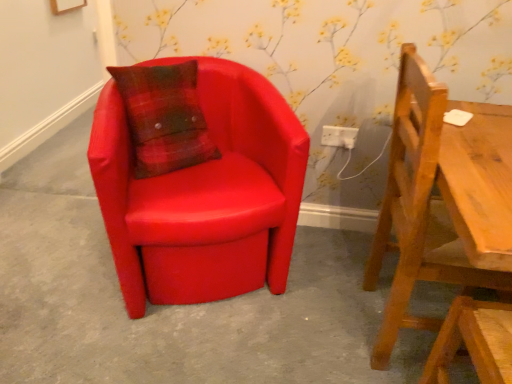
Where is `unoccupied region to the right of matte leather chair at left, acting as the 1th chair starting from the left`? The width and height of the screenshot is (512, 384). unoccupied region to the right of matte leather chair at left, acting as the 1th chair starting from the left is located at coordinates (322, 280).